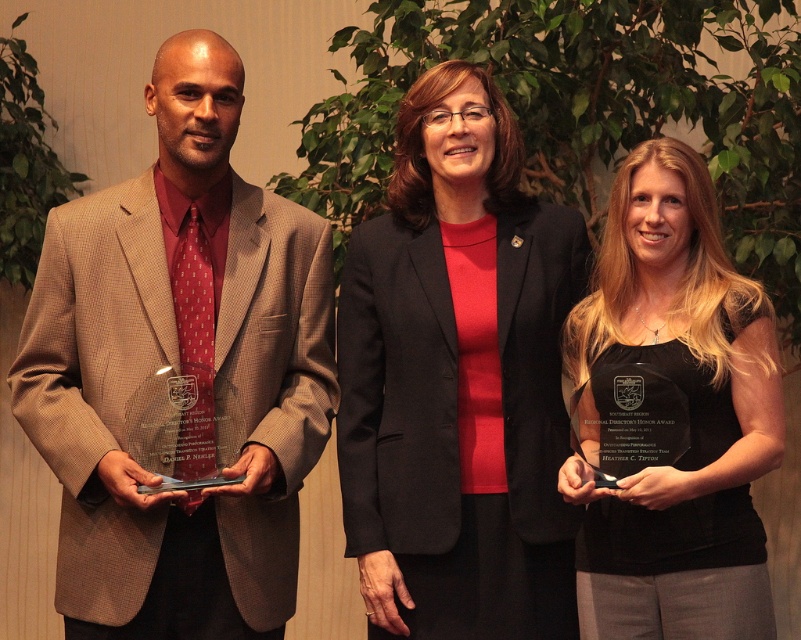
You are a photographer at an awards ceremony. You need to capture a photo of the two individuals wearing the matte brown suit at center and the matte black blazer at center. Which one is positioned to the left of the other?

The matte brown suit at center is positioned on the left side of the matte black blazer at center.

You are a photographer at an awards ceremony. You need to capture a photo of the matte brown suit at center and the black glossy award at center. Which one is positioned to the left?

The matte brown suit at center is to the left of the black glossy award at center.